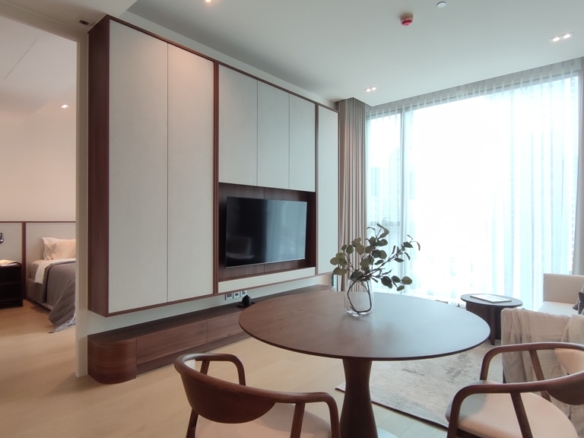
This screenshot has height=438, width=584. Find the location of `glass`. glass is located at coordinates (361, 289).